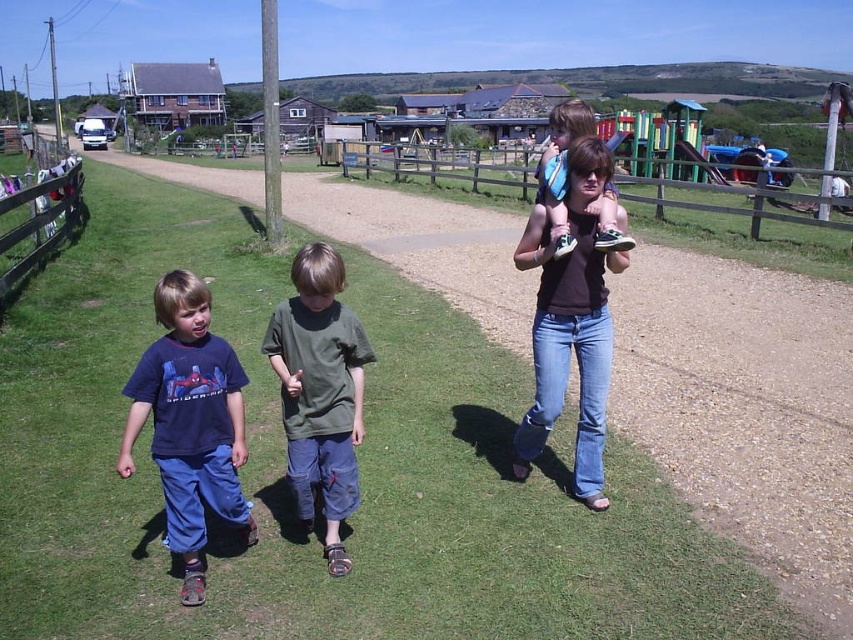
You are a photographer trying to capture a photo of the green cotton shirt at center and the wooden fence at left. Since you want both subjects to be clearly visible, which object should you zoom in on more to ensure they appear proportionally sized in the final image?

The green cotton shirt at center has a smaller width than the wooden fence at left, so you should zoom in more on the green cotton shirt at center to make it appear larger in the photo, balancing its size with the wooden fence at left.

You are a painter who wants to paint the wooden fence at center and the matte blue sneakers at center. If you have enough paint for either one of them, which object should you choose to paint based on their sizes?

The wooden fence at center has a larger width than the matte blue sneakers at center, so you should choose to paint the wooden fence at center because it requires more paint.